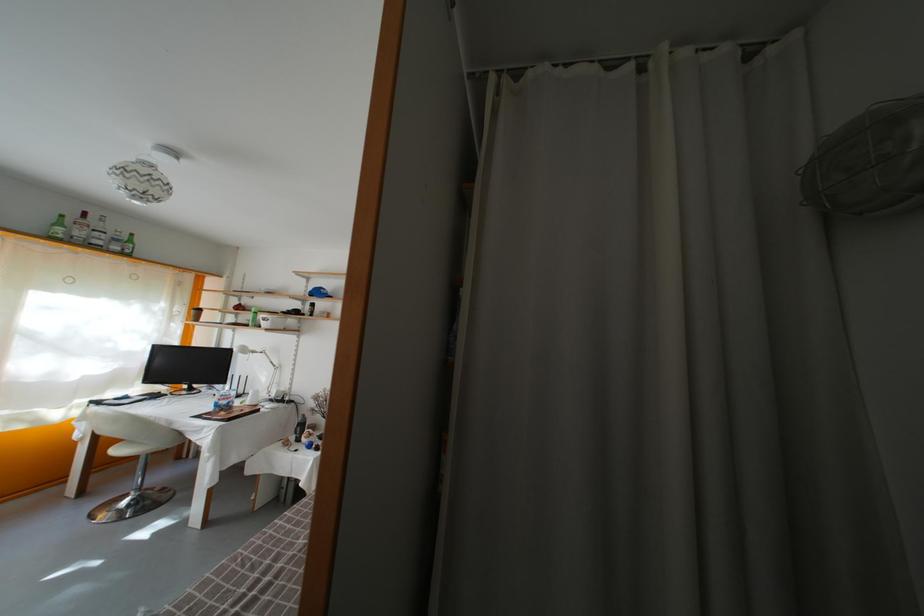
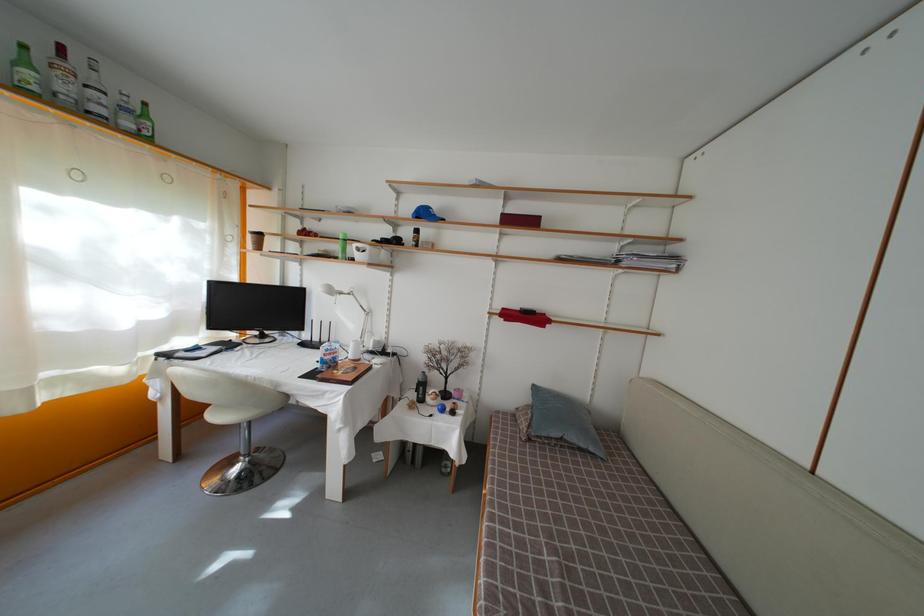
In the second image, find the point that corresponds to (67,230) in the first image.

(31, 69)